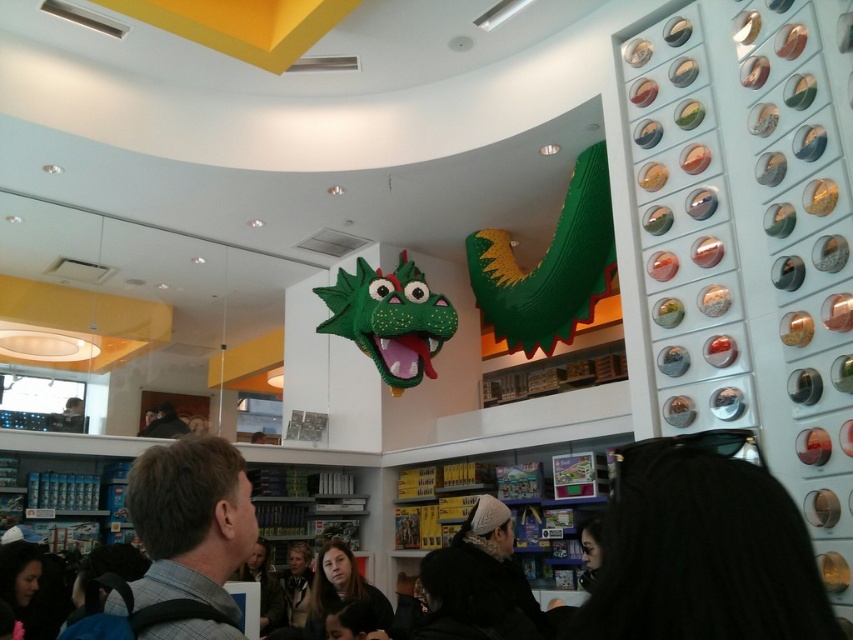
You are standing in the LEGO store and want to take a photo of the green matte dragon at upper center with your phone. The camera on your phone has a maximum focus range of 15 feet. Will you be able to take a clear photo of the dragon from your current position?

The green matte dragon at upper center is 16.92 feet away from the camera. Since the maximum focus range is 15 feet, the dragon is slightly out of range. You might need to move closer or use a different camera with a longer focus range to capture a clear photo.

Please provide the 2D coordinates of the dark brown leather jacket at center in the LEGO store image.

The dark brown leather jacket at center is located at coordinates point (297, 582).

You are standing at the camera position and want to reach point (x=614, y=625). Is the distance less than 30 inches?

The distance between point (x=614, y=625) and the camera is 28.58 inches, so yes, it is less than 30 inches.